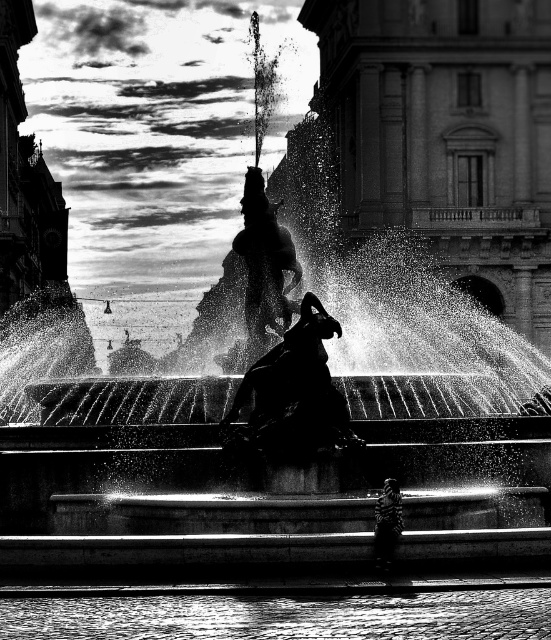
You are standing in the plaza and want to take a photo of the fountain. There are two points marked in the image. The first point is at coordinates point (290, 376) and the second point is at point (261, 180). Which point is closer to you when you are facing the fountain?

Point (290, 376) is in front of point (261, 180), so it is closer to you when facing the fountain.